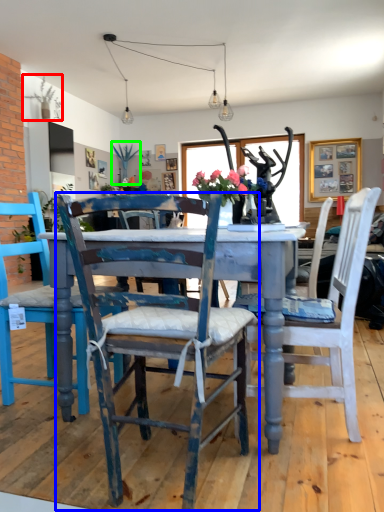
Question: Considering the real-world distances, which object is farthest from plant (highlighted by a red box)? chair (highlighted by a blue box) or plant (highlighted by a green box)?

Choices:
 (A) chair
 (B) plant

Answer: (A)